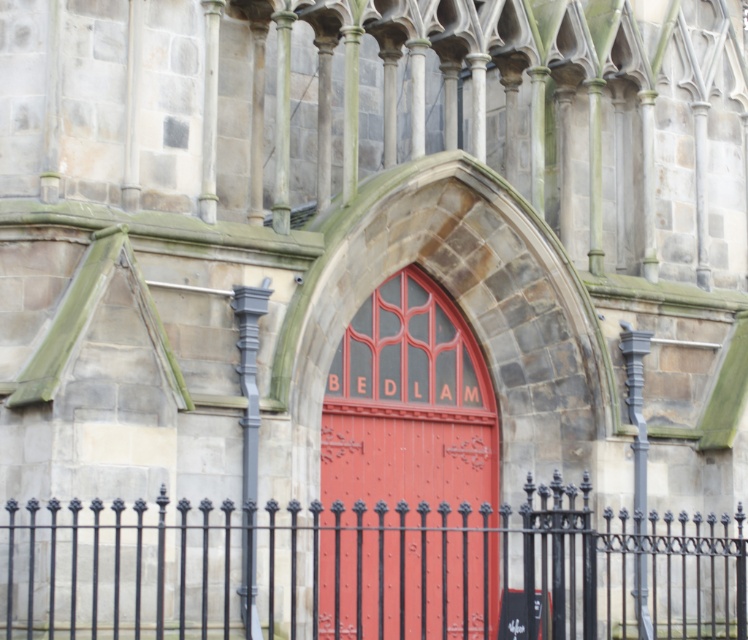
Question: Can you confirm if black wrought iron fence at lower center is positioned below smooth red door at center?

Choices:
 (A) yes
 (B) no

Answer: (A)

Question: Which of the following is the closest to the observer?

Choices:
 (A) smooth red door at center
 (B) black wrought iron fence at lower center

Answer: (B)

Question: Can you confirm if black wrought iron fence at lower center is thinner than smooth red door at center?

Choices:
 (A) no
 (B) yes

Answer: (A)

Question: From the image, what is the correct spatial relationship of black wrought iron fence at lower center in relation to smooth red door at center?

Choices:
 (A) left
 (B) right

Answer: (B)